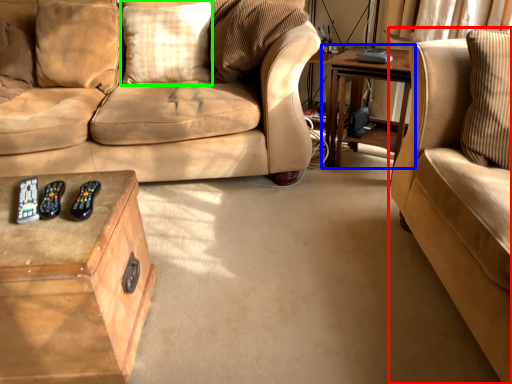
Question: Estimate the real-world distances between objects in this image. Which object is farther from studio couch (highlighted by a red box), table (highlighted by a blue box) or pillow (highlighted by a green box)?

Choices:
 (A) table
 (B) pillow

Answer: (B)